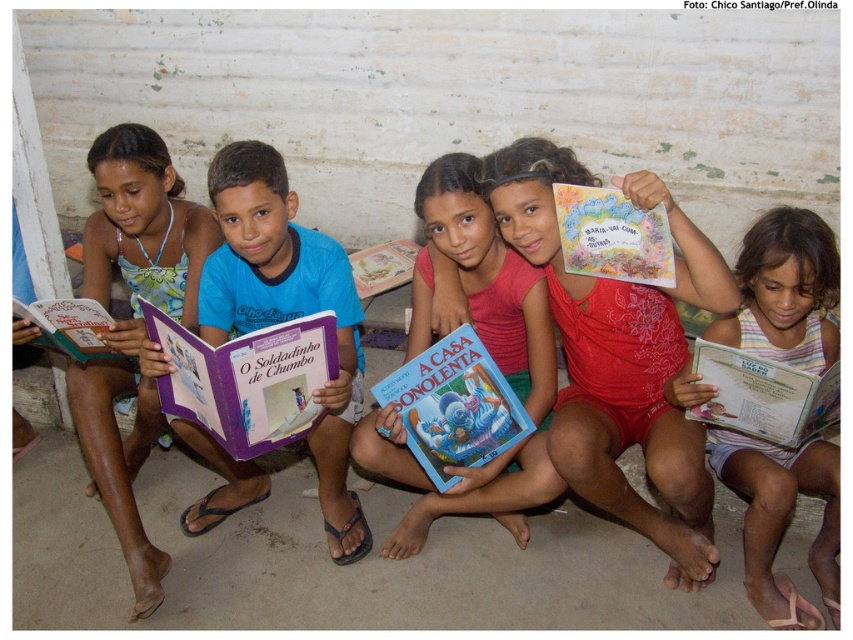
Question: Does matte red swimsuit at center come in front of blue paper book at center?

Choices:
 (A) yes
 (B) no

Answer: (A)

Question: Which object is the farthest from the blue cotton shirt at center?

Choices:
 (A) matte colorful book at center
 (B) blue paper book at center
 (C) white paper book at center

Answer: (C)

Question: Can you confirm if blue cotton shirt at center is wider than striped fabric dress at center?

Choices:
 (A) yes
 (B) no

Answer: (A)

Question: From the image, what is the correct spatial relationship of purple glossy book at center in relation to blue paper book at center?

Choices:
 (A) right
 (B) left

Answer: (B)

Question: Which of the following is the closest to the observer?

Choices:
 (A) (816, 323)
 (B) (234, 445)

Answer: (B)

Question: Estimate the real-world distances between objects in this image. Which object is closer to the white paper book at center?

Choices:
 (A) hardcover book at center
 (B) striped fabric dress at center
 (C) blue cotton shirt at center

Answer: (B)